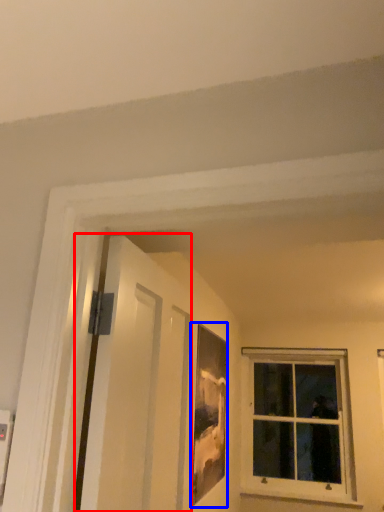
Question: Which object appears farthest to the camera in this image, screen door (highlighted by a red box) or picture frame (highlighted by a blue box)?

Choices:
 (A) screen door
 (B) picture frame

Answer: (B)